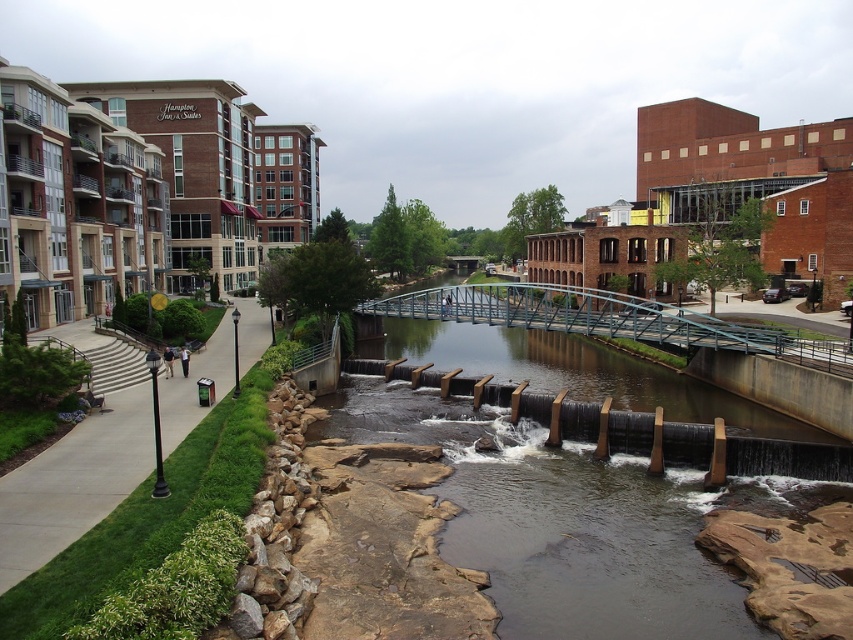
Question: From the image, what is the correct spatial relationship of brown stone stream at center in relation to green grass at left?

Choices:
 (A) right
 (B) left

Answer: (A)

Question: Among these objects, which one is nearest to the camera?

Choices:
 (A) green grass at left
 (B) brown stone stream at center

Answer: (A)

Question: Among these points, which one is farthest from the camera?

Choices:
 (A) (74, 488)
 (B) (381, 401)

Answer: (B)

Question: Is brown stone stream at center above green grass at left?

Choices:
 (A) yes
 (B) no

Answer: (A)

Question: Is brown stone stream at center bigger than green grass at left?

Choices:
 (A) yes
 (B) no

Answer: (A)